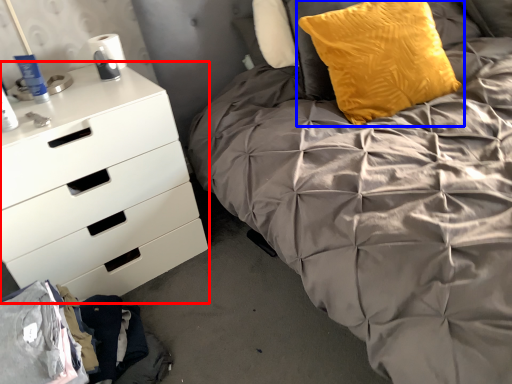
Question: Among these objects, which one is nearest to the camera, chest of drawers (highlighted by a red box) or pillow (highlighted by a blue box)?

Choices:
 (A) chest of drawers
 (B) pillow

Answer: (A)